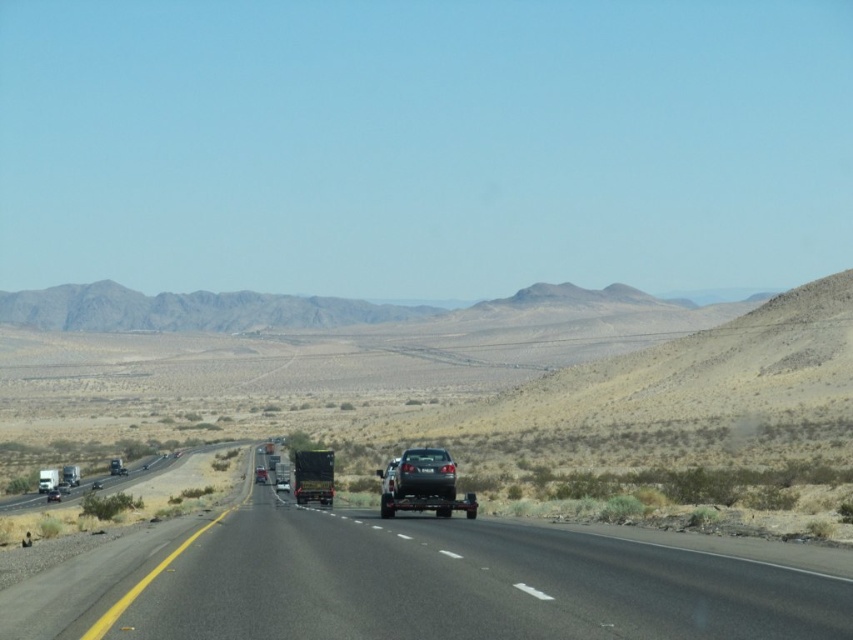
Question: In this image, where is black metallic truck at center located relative to matte black truck at center?

Choices:
 (A) above
 (B) below

Answer: (A)

Question: Does shiny silver car at center appear on the right side of green matte trailer truck at center?

Choices:
 (A) no
 (B) yes

Answer: (B)

Question: Which object is farther from the camera taking this photo?

Choices:
 (A) matte black truck at center
 (B) shiny silver car at center
 (C) green matte trailer truck at center

Answer: (A)

Question: Which of these objects is positioned closest to the green matte trailer truck at center?

Choices:
 (A) glossy black truck at center
 (B) shiny silver car at center
 (C) matte black truck at center
 (D) black metallic truck at center

Answer: (B)

Question: Can you confirm if glossy black truck at center is positioned below matte black truck at center?

Choices:
 (A) no
 (B) yes

Answer: (B)

Question: Which of the following is the farthest from the observer?

Choices:
 (A) (299, 488)
 (B) (450, 492)
 (C) (440, 592)
 (D) (260, 465)

Answer: (D)